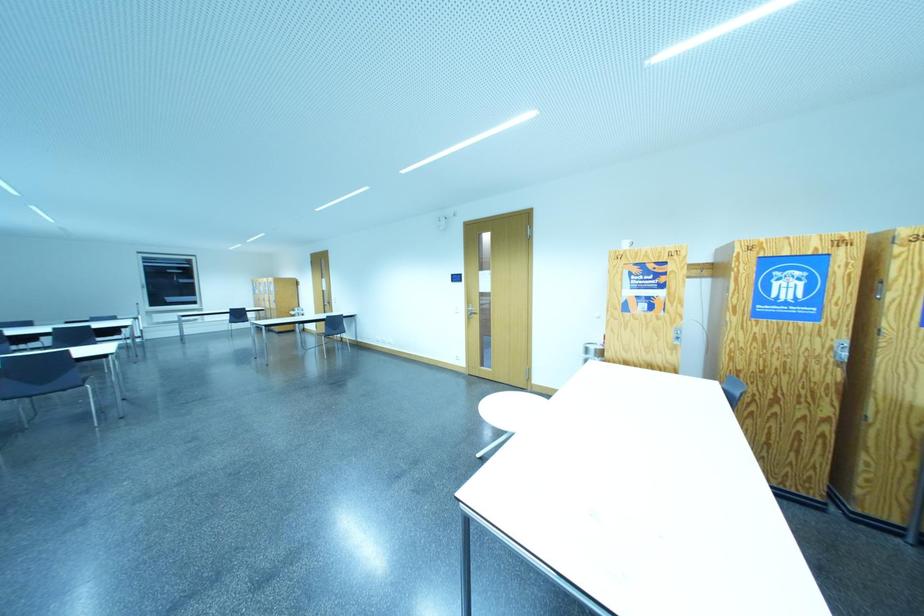
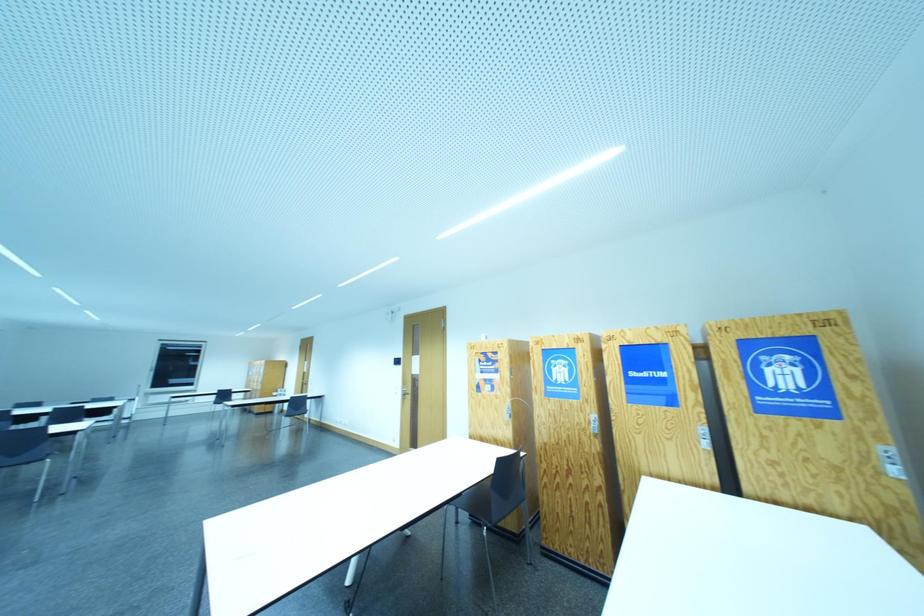
The images are taken continuously from a first-person perspective. In which direction are you moving?

The cameraman walked toward right, backward.